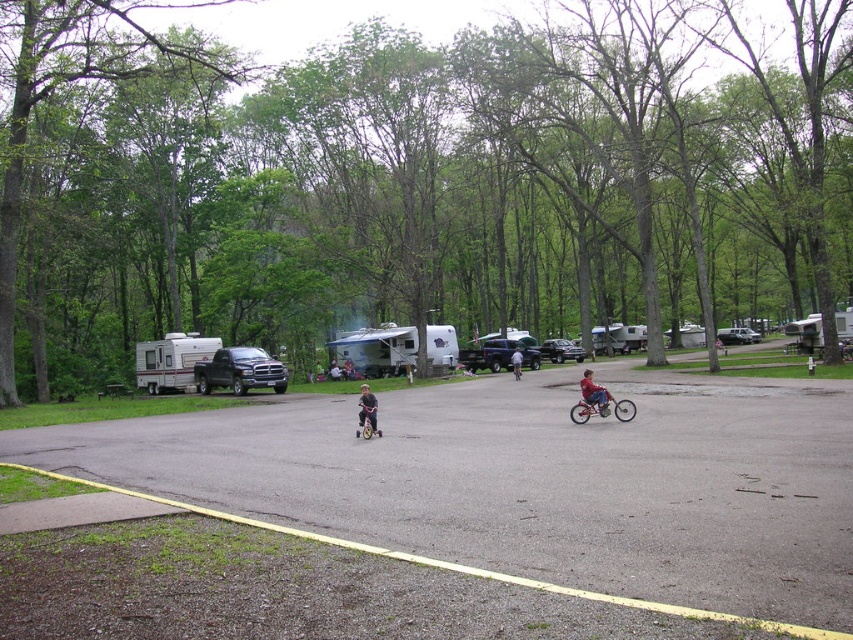
In the scene shown: Can you confirm if white plastic camper at center is positioned to the right of silver metallic van at center?

Incorrect, white plastic camper at center is not on the right side of silver metallic van at center.

Which is below, white plastic camper at center or silver metallic van at center?

silver metallic van at center is lower down.

Which is in front, point (614, 349) or point (749, 332)?

Point (614, 349)

You are a GUI agent. You are given a task and a screenshot of the screen. Output one action in this format:
    pyautogui.click(x=<x>, y=<y>)
    Task: Click on the white plastic camper at center
    
    Given the screenshot: What is the action you would take?
    pyautogui.click(x=619, y=337)

Between point (364, 406) and point (741, 332), which one is positioned in front?

Point (364, 406) is in front.

Is point (366, 385) closer to viewer compared to point (724, 342)?

Yes, point (366, 385) is in front of point (724, 342).

Describe the element at coordinates (368, 410) in the screenshot. This screenshot has width=853, height=640. I see `dark brown fur dog at center` at that location.

This screenshot has width=853, height=640. Find the location of `dark brown fur dog at center`. dark brown fur dog at center is located at coordinates (368, 410).

Who is positioned more to the right, white plastic camper at right or light blue denim shorts at center?

white plastic camper at right

You are a GUI agent. You are given a task and a screenshot of the screen. Output one action in this format:
    pyautogui.click(x=<x>, y=<y>)
    Task: Click on the white plastic camper at right
    The width and height of the screenshot is (853, 640).
    Given the screenshot: What is the action you would take?
    pyautogui.click(x=805, y=333)

Where is `white plastic camper at right`? white plastic camper at right is located at coordinates pos(805,333).